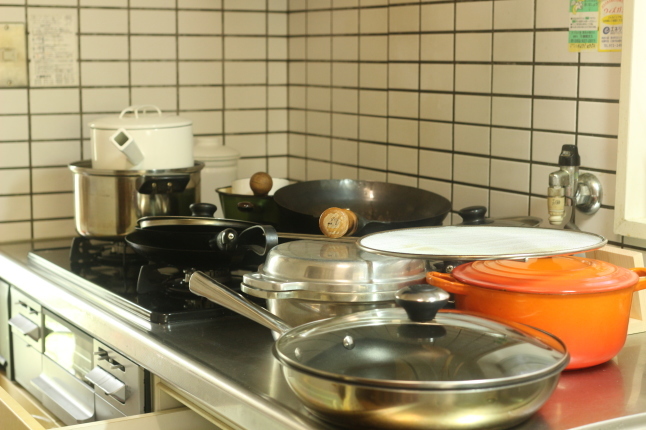
Find the location of a particular element. The image size is (646, 430). oven is located at coordinates (59, 368).